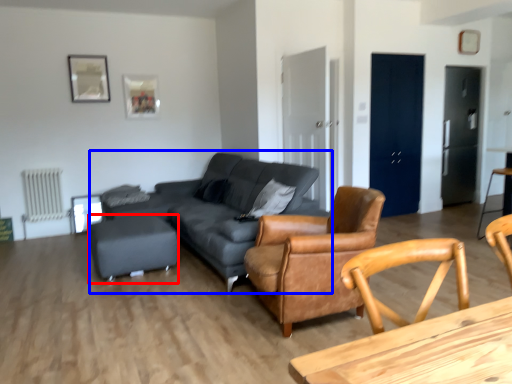
Question: Which point is further to the camera, bar stool (highlighted by a red box) or studio couch (highlighted by a blue box)?

Choices:
 (A) bar stool
 (B) studio couch

Answer: (A)